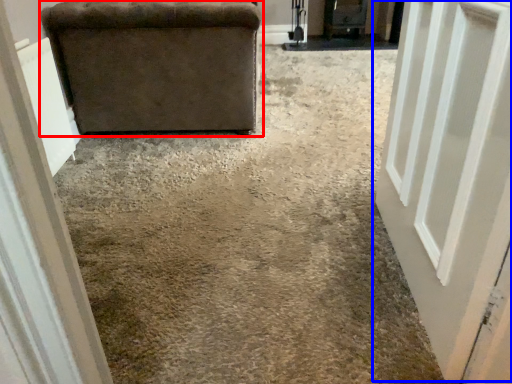
Question: Which of the following is the farthest to the observer, furniture (highlighted by a red box) or door (highlighted by a blue box)?

Choices:
 (A) furniture
 (B) door

Answer: (A)